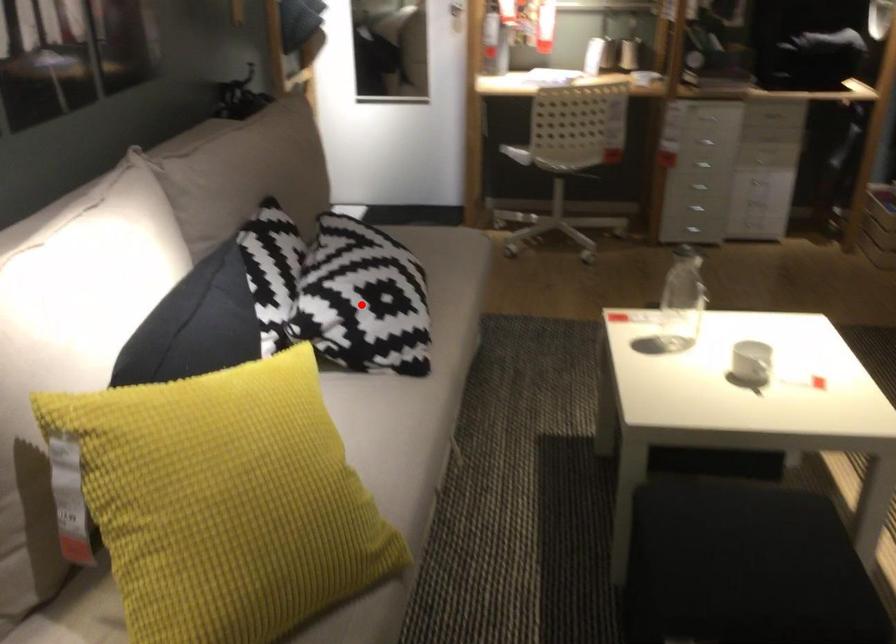
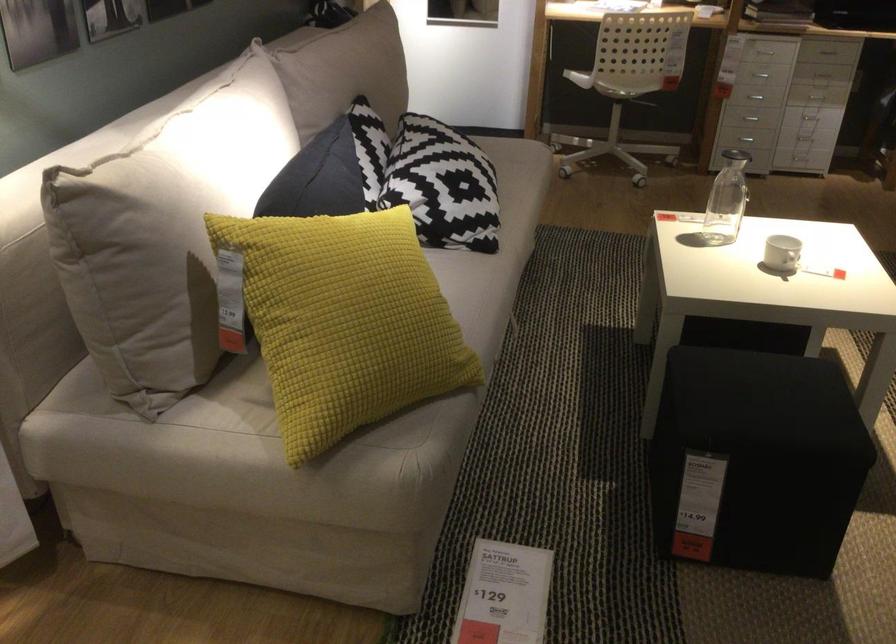
Where in the second image is the point corresponding to the highlighted location from the first image?

(442, 185)